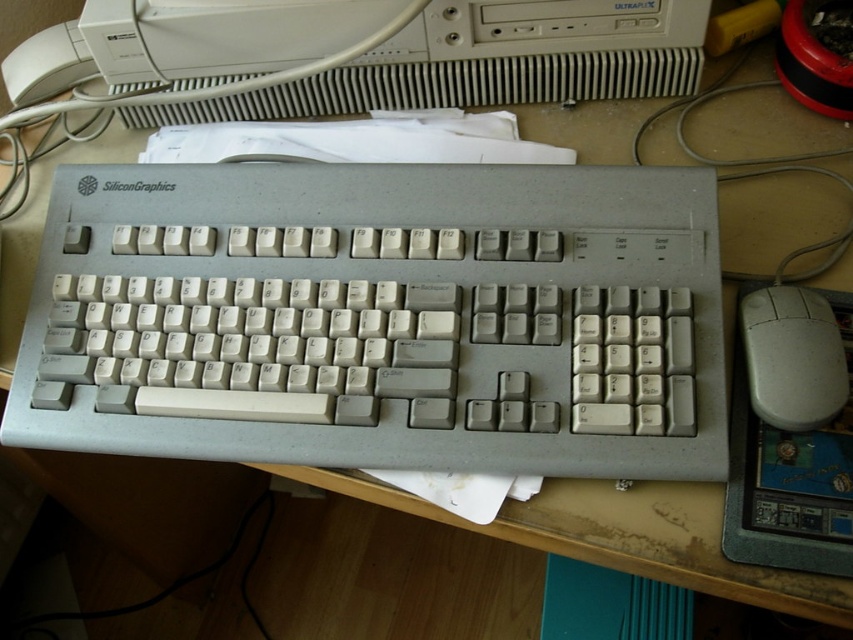
Who is higher up, white plastic keyboard at center or white plastic mouse at right?

white plastic keyboard at center is above.

Is white plastic keyboard at center smaller than white plastic mouse at right?

Actually, white plastic keyboard at center might be larger than white plastic mouse at right.

You are a GUI agent. You are given a task and a screenshot of the screen. Output one action in this format:
    pyautogui.click(x=<x>, y=<y>)
    Task: Click on the white plastic keyboard at center
    This screenshot has width=853, height=640.
    Given the screenshot: What is the action you would take?
    pyautogui.click(x=379, y=317)

Identify the location of white plastic keyboard at center. This screenshot has width=853, height=640. (379, 317).

Can you confirm if white plastic desktop computer at upper center is thinner than white plastic mouse at right?

No.

Is white plastic desktop computer at upper center above white plastic mouse at right?

Correct, white plastic desktop computer at upper center is located above white plastic mouse at right.

You are a GUI agent. You are given a task and a screenshot of the screen. Output one action in this format:
    pyautogui.click(x=<x>, y=<y>)
    Task: Click on the white plastic desktop computer at upper center
    Image resolution: width=853 pixels, height=640 pixels.
    Given the screenshot: What is the action you would take?
    pyautogui.click(x=461, y=64)

Which of these two, white plastic keyboard at center or white plastic desktop computer at upper center, stands shorter?

white plastic desktop computer at upper center is shorter.

Is white plastic keyboard at center wider than white plastic desktop computer at upper center?

Incorrect, white plastic keyboard at center's width does not surpass white plastic desktop computer at upper center's.

Where is `white plastic keyboard at center`? The image size is (853, 640). white plastic keyboard at center is located at coordinates (379, 317).

Where is `white plastic keyboard at center`? Image resolution: width=853 pixels, height=640 pixels. white plastic keyboard at center is located at coordinates (379, 317).